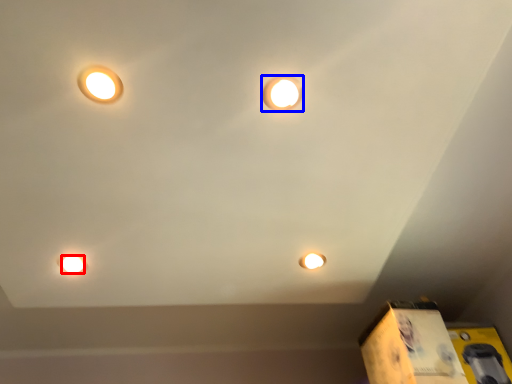
Question: Which object is closer to the camera taking this photo, light bulb (highlighted by a red box) or lamp (highlighted by a blue box)?

Choices:
 (A) light bulb
 (B) lamp

Answer: (B)